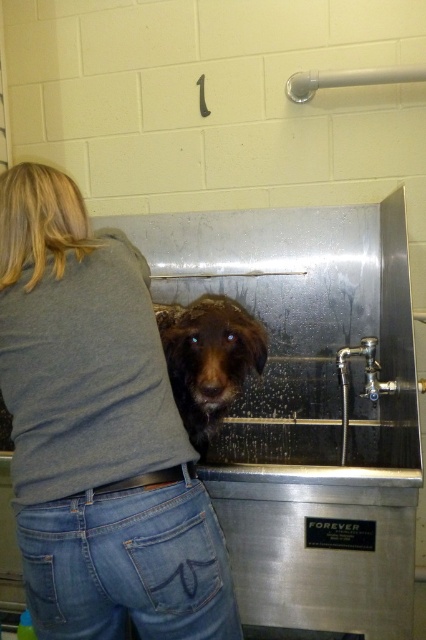
Question: Is gray cotton shirt at center positioned at the back of wet brown fur at center?

Choices:
 (A) no
 (B) yes

Answer: (A)

Question: Is gray cotton shirt at center further to the viewer compared to wet brown fur at center?

Choices:
 (A) no
 (B) yes

Answer: (A)

Question: Which object appears farthest from the camera in this image?

Choices:
 (A) wet brown fur at center
 (B) gray cotton shirt at center

Answer: (A)

Question: Which point is closer to the camera taking this photo?

Choices:
 (A) (100, 476)
 (B) (192, 433)

Answer: (A)

Question: Does gray cotton shirt at center appear on the left side of wet brown fur at center?

Choices:
 (A) yes
 (B) no

Answer: (A)